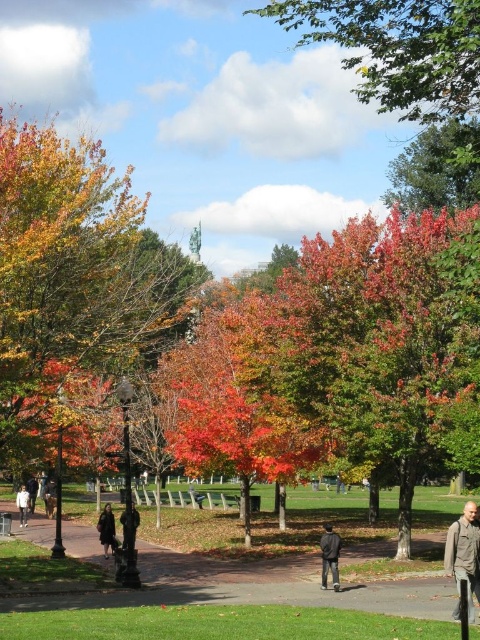
Question: Which object is the closest to the dark brown leather coat at lower center?

Choices:
 (A) multicolored foliage at center
 (B) dark gray jacket at center
 (C) gray fabric jacket at lower right

Answer: (B)

Question: Can you confirm if multicolored foliage at center is positioned to the left of dark gray jacket at center?

Choices:
 (A) no
 (B) yes

Answer: (B)

Question: Which object appears closest to the camera in this image?

Choices:
 (A) gray fabric jacket at lower right
 (B) multicolored foliage at center
 (C) dark brown leather coat at lower center
 (D) smooth asphalt path at center

Answer: (A)

Question: Is smooth asphalt path at center smaller than white cotton jacket at lower left?

Choices:
 (A) no
 (B) yes

Answer: (A)

Question: Is dark brown leather coat at lower center smaller than white cotton jacket at lower left?

Choices:
 (A) yes
 (B) no

Answer: (B)

Question: Estimate the real-world distances between objects in this image. Which object is farther from the white cotton jacket at lower left?

Choices:
 (A) gray fabric jacket at lower right
 (B) multicolored foliage at center

Answer: (A)